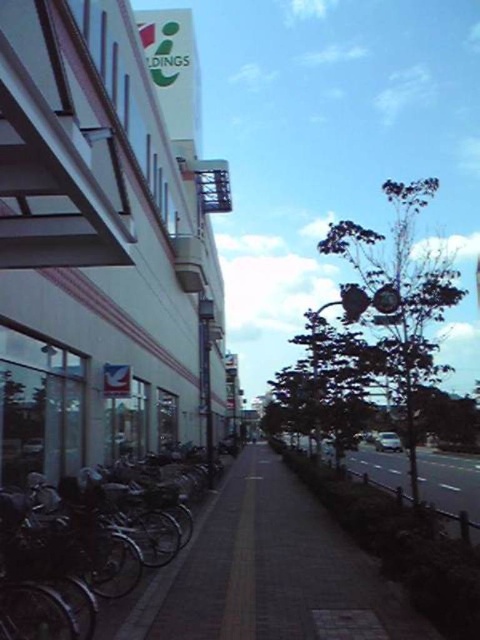
You are a delivery person standing on the brick paved sidewalk at center and need to place a large package on the ground. Can you place the package on the silver metallic bicycle at left without stepping off the sidewalk?

The brick paved sidewalk at center is taller than the silver metallic bicycle at left, so you can place the package on the silver metallic bicycle at left without stepping off the sidewalk.

You are standing on the sidewalk in front of the building and want to take a photo of both point (103, 525) and point (243, 592). Which point should you focus on first to ensure both are in focus?

You should focus on point (103, 525) first because it is closer to the camera than point (243, 592), ensuring both are within the depth of field.

You are a delivery person who needs to walk from the building to the sidewalk. Which direction should you go from the smooth asphalt road at center to reach the brick paved sidewalk at center?

The brick paved sidewalk at center is to the right of the smooth asphalt road at center, so you should go to the right to reach it.